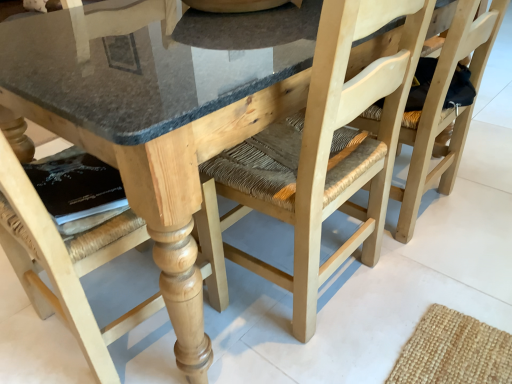
Question: Visually, is natural wood chair at lower left, placed as the first chair when sorted from left to right, positioned to the left or to the right of natural wood chair at center, positioned as the third chair in left-to-right order?

Choices:
 (A) left
 (B) right

Answer: (A)

Question: From a real-world perspective, is natural wood chair at lower left, the 3th chair in the right-to-left sequence, physically located above or below natural wood chair at center, positioned as the third chair in left-to-right order?

Choices:
 (A) above
 (B) below

Answer: (A)

Question: Which object is the closest to the natural wood chair at center, positioned as the third chair in left-to-right order?

Choices:
 (A) natural wood chair at lower left, placed as the first chair when sorted from left to right
 (B) natural wood chair at center, acting as the 2th chair starting from the right

Answer: (B)

Question: Estimate the real-world distances between objects in this image. Which object is farther from the natural wood chair at center, the first chair positioned from the right?

Choices:
 (A) natural wood chair at center, the second chair positioned from the left
 (B) natural wood chair at lower left, the 3th chair in the right-to-left sequence

Answer: (B)